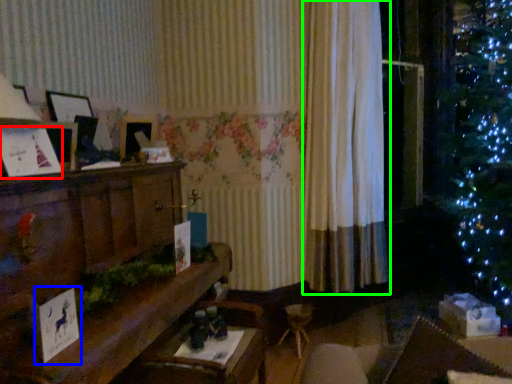
Question: Considering the real-world distances, which object is farthest from christmas card (highlighted by a red box)? christmas card (highlighted by a blue box) or curtain (highlighted by a green box)?

Choices:
 (A) christmas card
 (B) curtain

Answer: (B)